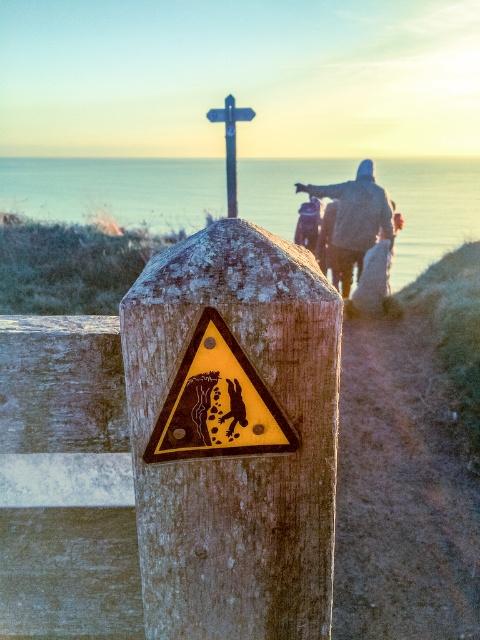
You are a hiker planning to take a photo of the weathered wood post at center and the yellow matte warning sign at center. Since you want both objects to appear clearly in the frame, which object should you focus on to ensure proper focus given their sizes?

The weathered wood post at center has a larger size compared to the yellow matte warning sign at center, so focusing on the weathered wood post at center will ensure both are in focus as it is the larger object.

You are a hiker planning to take a photo of the gray woolen sweater at upper right. To get the best shot, you need to position yourself so that the weathered wood post at center does not block your view. Where should you move relative to the post?

Move to the side of the weathered wood post at center so that the gray woolen sweater at upper right becomes visible without obstruction.